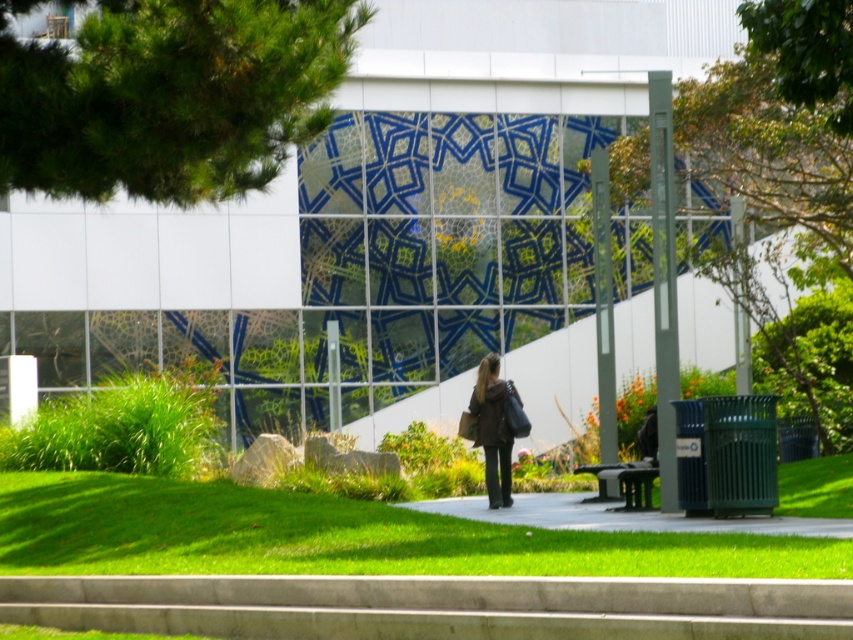
Can you confirm if green grass at lower center is smaller than dark brown leather jacket at center?

No.

Is point (834, 550) farther from viewer compared to point (488, 369)?

No, (834, 550) is closer to viewer.

The height and width of the screenshot is (640, 853). I want to click on green grass at lower center, so click(x=341, y=536).

Who is more forward, [38,186] or [604,566]?

Point [604,566] is in front.

Is green leafy tree at upper left to the right of green grass at lower center from the viewer's perspective?

Incorrect, green leafy tree at upper left is not on the right side of green grass at lower center.

Does point (227, 13) lie behind point (287, 545)?

Yes, point (227, 13) is behind point (287, 545).

Locate an element on the screen. This screenshot has height=640, width=853. green leafy tree at upper left is located at coordinates (169, 96).

Between green grass at lower center and green leafy tree at right, which one has less height?

green grass at lower center

Is point (79, 540) closer to viewer compared to point (741, 58)?

Yes, it is.

Find the location of a particular element. The image size is (853, 640). green grass at lower center is located at coordinates (341, 536).